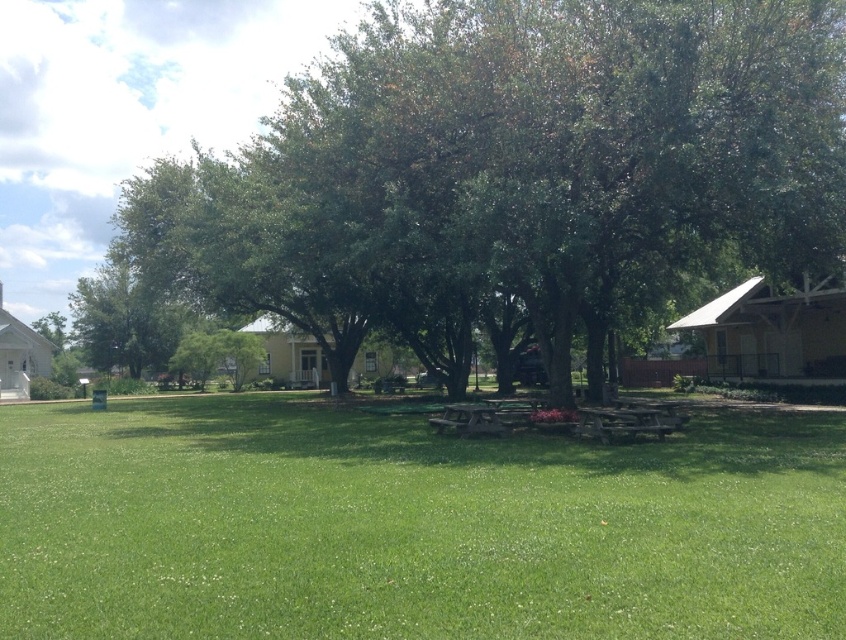
Question: In this image, where is green leafy tree at center located relative to green grass at center?

Choices:
 (A) above
 (B) below

Answer: (A)

Question: Which point appears farthest from the camera in this image?

Choices:
 (A) (234, 586)
 (B) (388, 22)

Answer: (B)

Question: Among these objects, which one is farthest from the camera?

Choices:
 (A) green grass at center
 (B) green leafy tree at center

Answer: (B)

Question: Does green leafy tree at center have a greater width compared to green grass at center?

Choices:
 (A) no
 (B) yes

Answer: (B)

Question: Observing the image, what is the correct spatial positioning of green leafy tree at center in reference to green grass at center?

Choices:
 (A) above
 (B) below

Answer: (A)